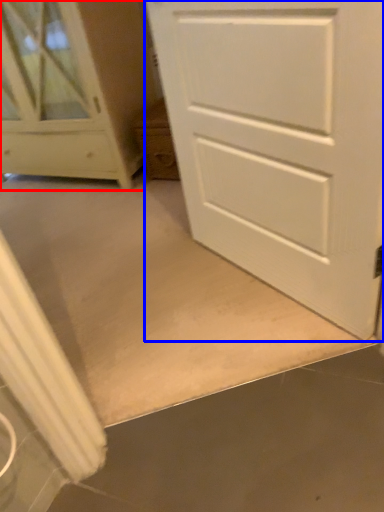
Question: Among these objects, which one is nearest to the camera, chest of drawers (highlighted by a red box) or door (highlighted by a blue box)?

Choices:
 (A) chest of drawers
 (B) door

Answer: (B)